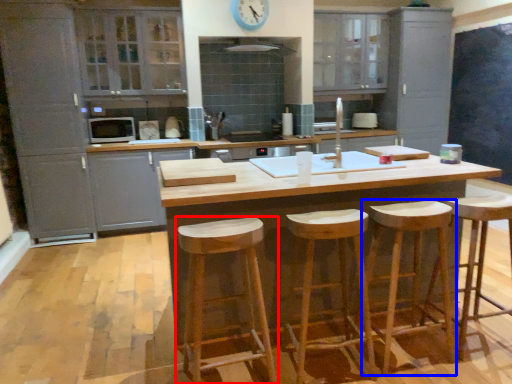
Question: Which of the following is the closest to the observer, stool (highlighted by a red box) or stool (highlighted by a blue box)?

Choices:
 (A) stool
 (B) stool

Answer: (A)